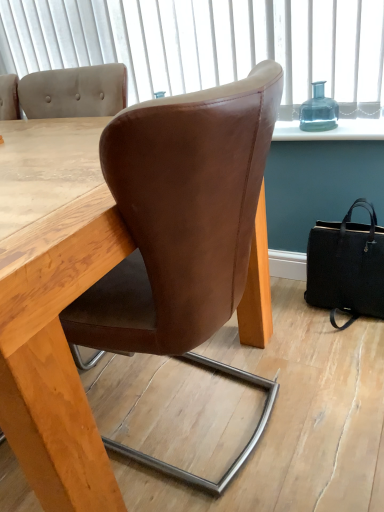
Locate an element on the screen. The image size is (384, 512). blank space to the left of black leather handbag at lower right is located at coordinates (311, 323).